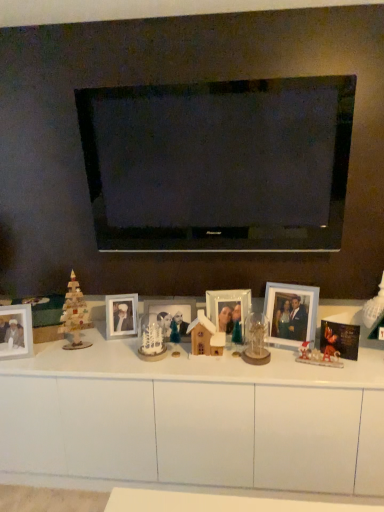
Identify the location of vacant space to the left of wooden house at center, which is the second toy in right-to-left order. Image resolution: width=384 pixels, height=512 pixels. (167, 359).